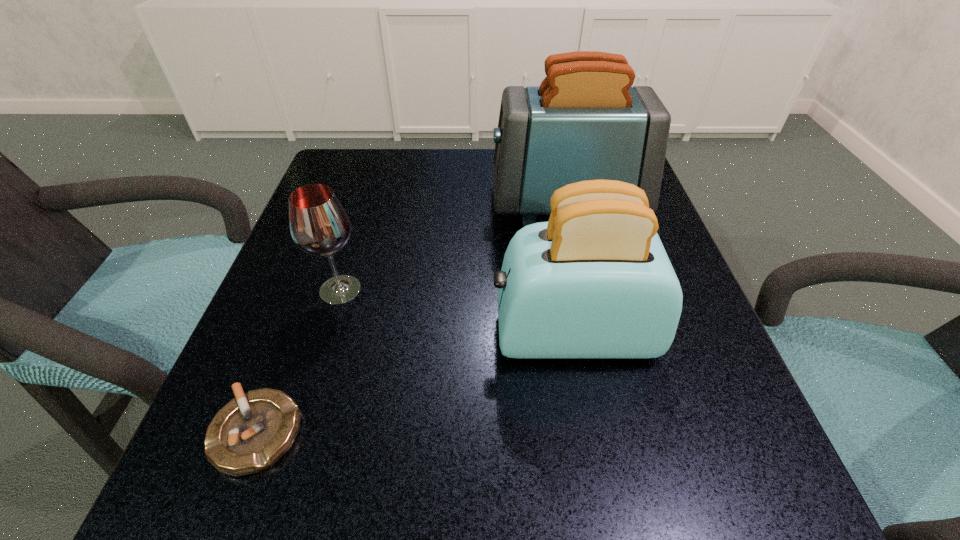
Find the location of a particular element. The height and width of the screenshot is (540, 960). the farther toaster is located at coordinates (584, 122).

In order to click on the nearer toaster in this screenshot , I will do `click(594, 282)`.

The image size is (960, 540). Identify the location of wineglass. (319, 225).

Identify the location of ashtray. The image size is (960, 540). (248, 435).

Find the location of a particular element. The image size is (960, 540). the shortest object is located at coordinates (248, 435).

Where is `vacant area situated on the front-facing side of the farther toaster`? This screenshot has width=960, height=540. vacant area situated on the front-facing side of the farther toaster is located at coordinates (403, 204).

Locate an element on the screen. Image resolution: width=960 pixels, height=540 pixels. vacant region located on the front-facing side of the farther toaster is located at coordinates click(464, 204).

Identify the location of free location located 0.270m on the front-facing side of the farther toaster. (367, 204).

Where is `vacant space located on the side of the nearer toaster with the lever`? Image resolution: width=960 pixels, height=540 pixels. vacant space located on the side of the nearer toaster with the lever is located at coordinates (291, 334).

The width and height of the screenshot is (960, 540). Identify the location of free location located 0.140m on the side of the nearer toaster with the lever. (404, 334).